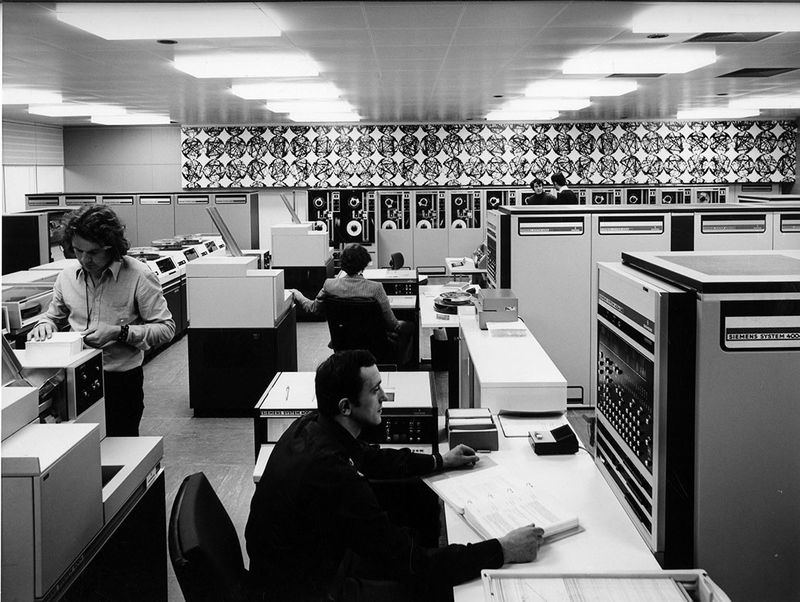
Find the location of `table`. table is located at coordinates (569, 494), (400, 305).